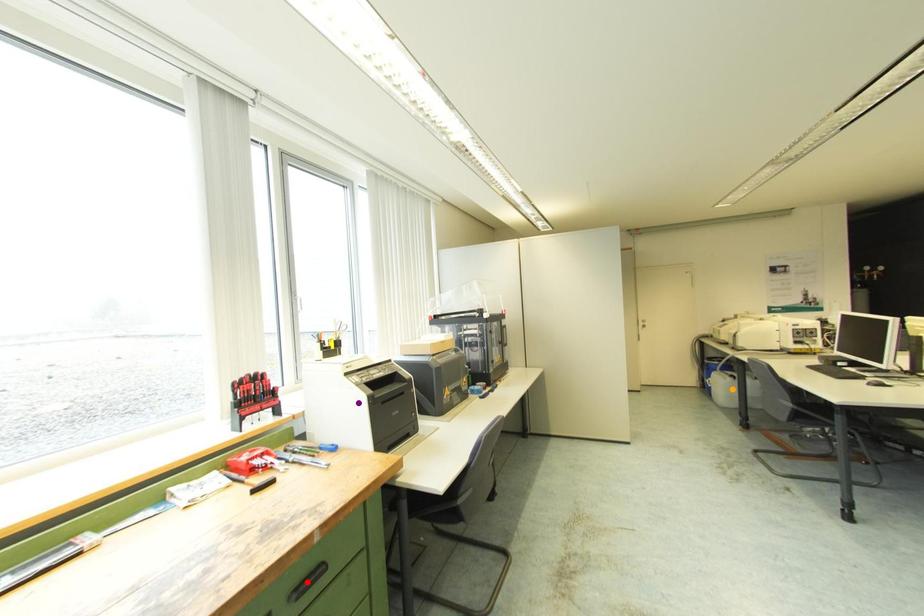
Order these from nearest to farthest:
- red point
- orange point
- purple point

red point → purple point → orange point